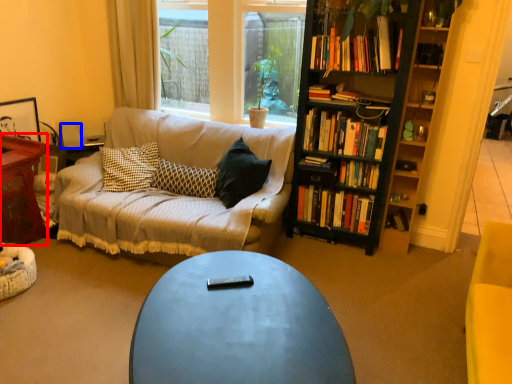
Question: Which object is further to the camera taking this photo, table (highlighted by a red box) or loudspeaker (highlighted by a blue box)?

Choices:
 (A) table
 (B) loudspeaker

Answer: (B)